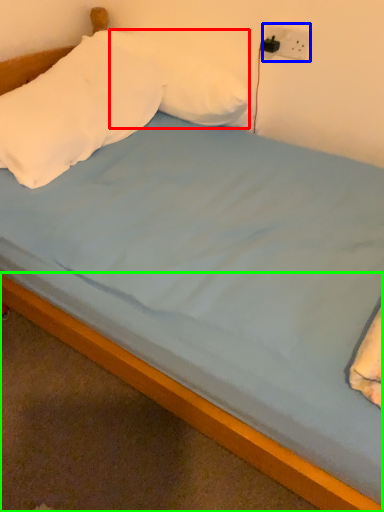
Question: Estimate the real-world distances between objects in this image. Which object is closer to pillow (highlighted by a red box), electric outlet (highlighted by a blue box) or bed frame (highlighted by a green box)?

Choices:
 (A) electric outlet
 (B) bed frame

Answer: (A)